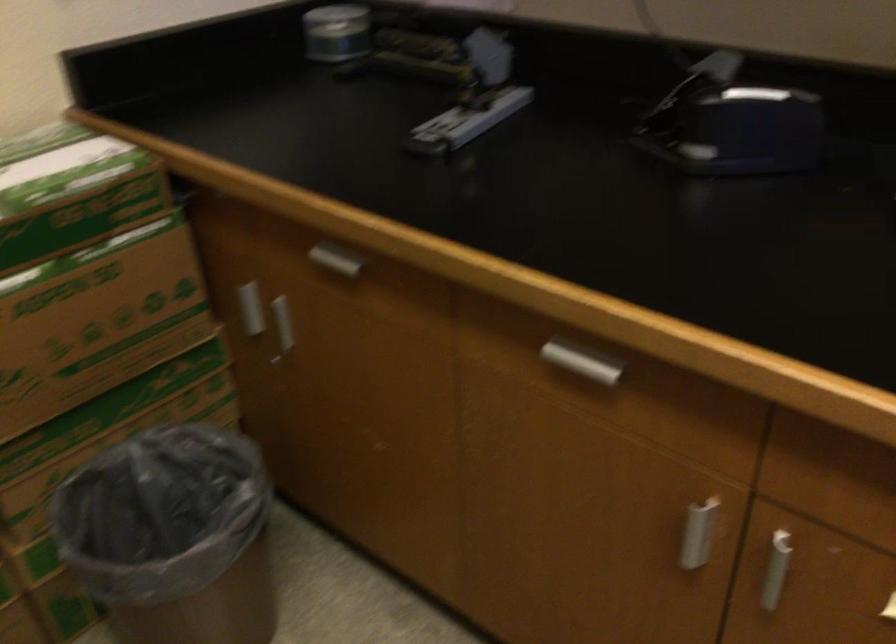
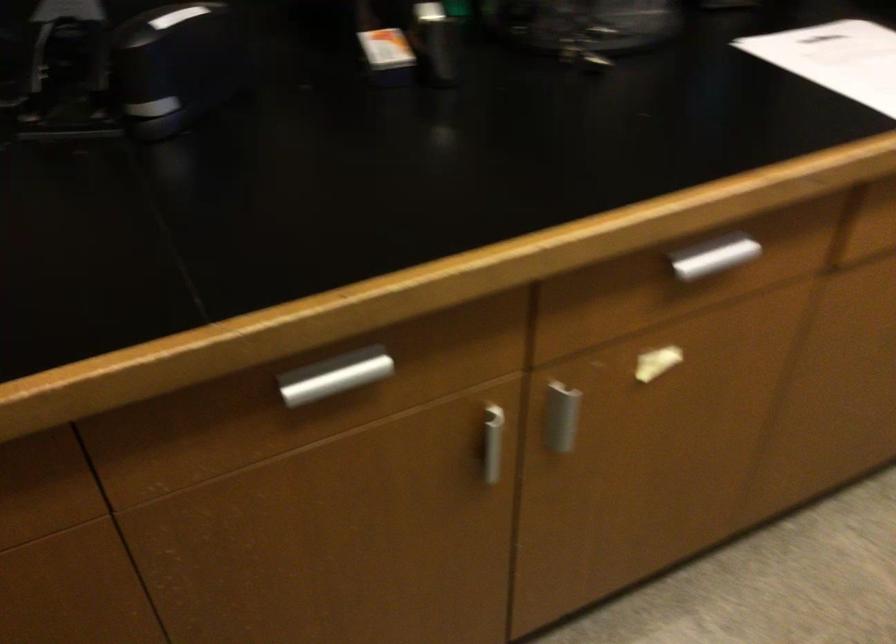
In the second image, find the point that corresponds to [702,527] in the first image.

(487, 442)